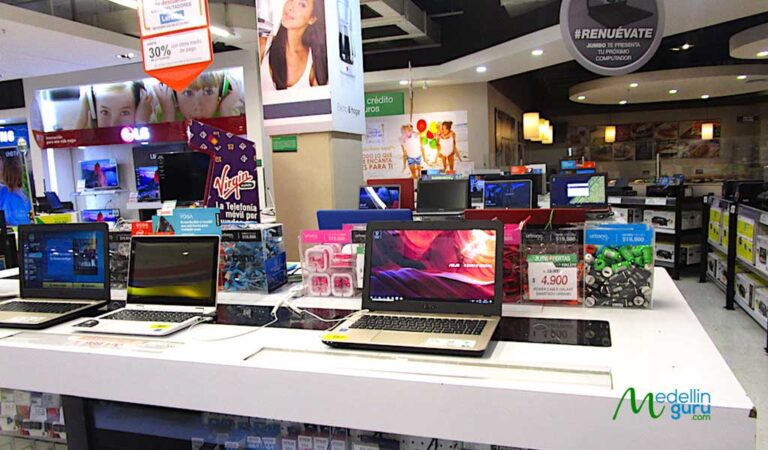
I want to click on cable, so click(x=313, y=314).